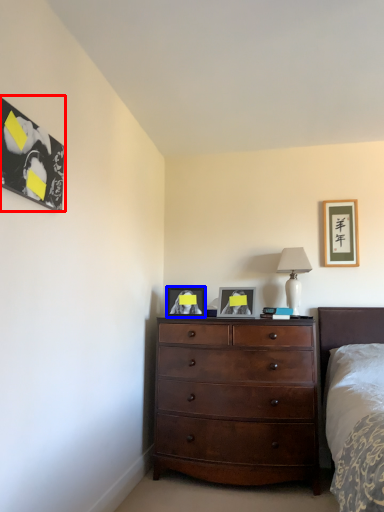
Question: Among these objects, which one is farthest to the camera, picture frame (highlighted by a red box) or picture frame (highlighted by a blue box)?

Choices:
 (A) picture frame
 (B) picture frame

Answer: (B)